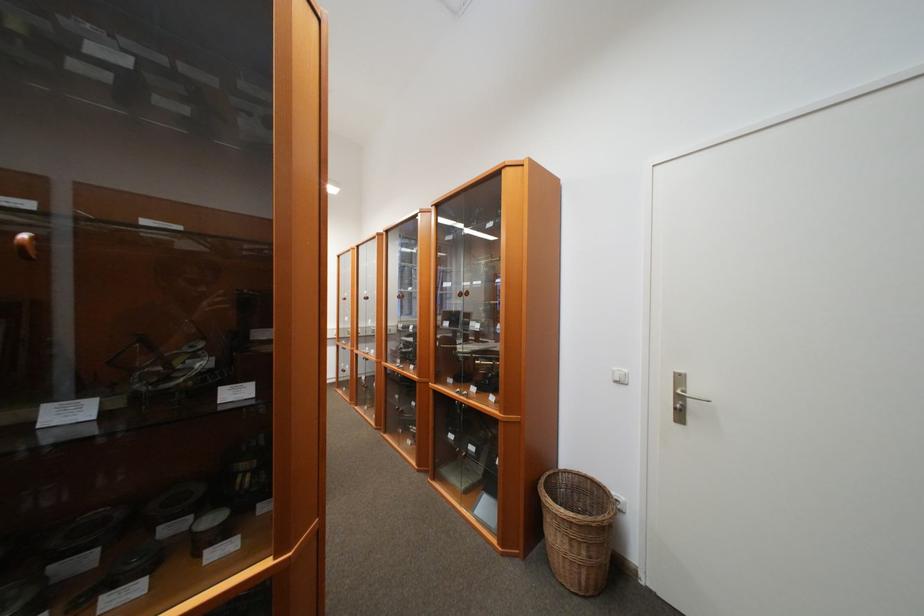
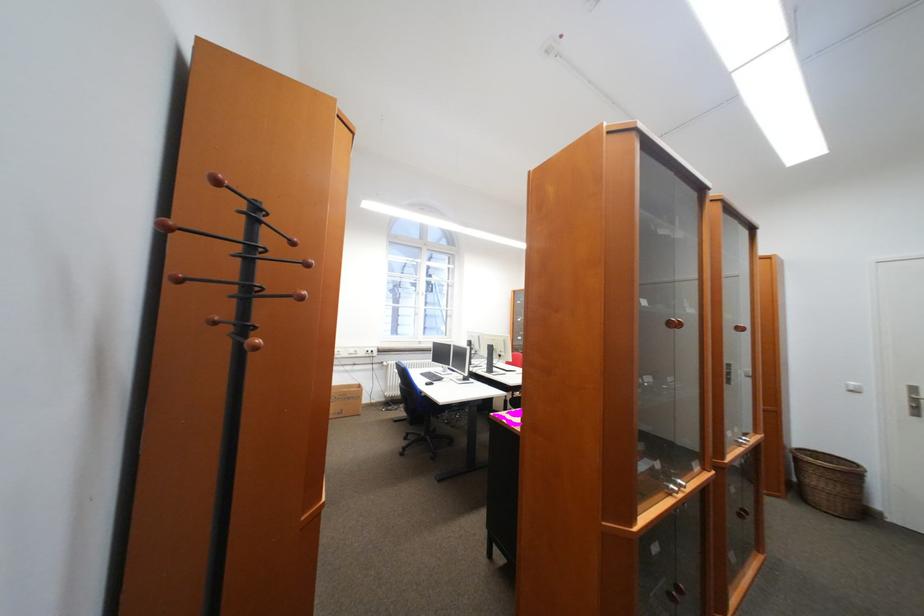
The point at (565, 562) is marked in the first image. Where is the corresponding point in the second image?

(830, 499)